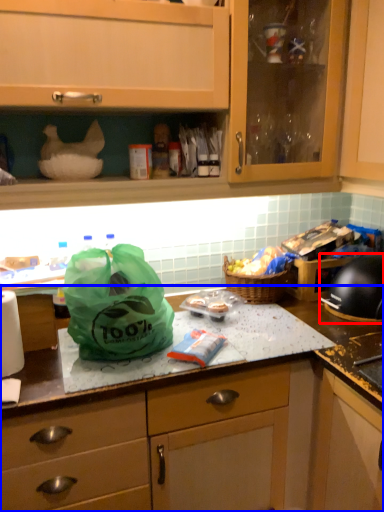
Question: Which object is further to the camera taking this photo, kitchen appliance (highlighted by a red box) or countertop (highlighted by a blue box)?

Choices:
 (A) kitchen appliance
 (B) countertop

Answer: (A)